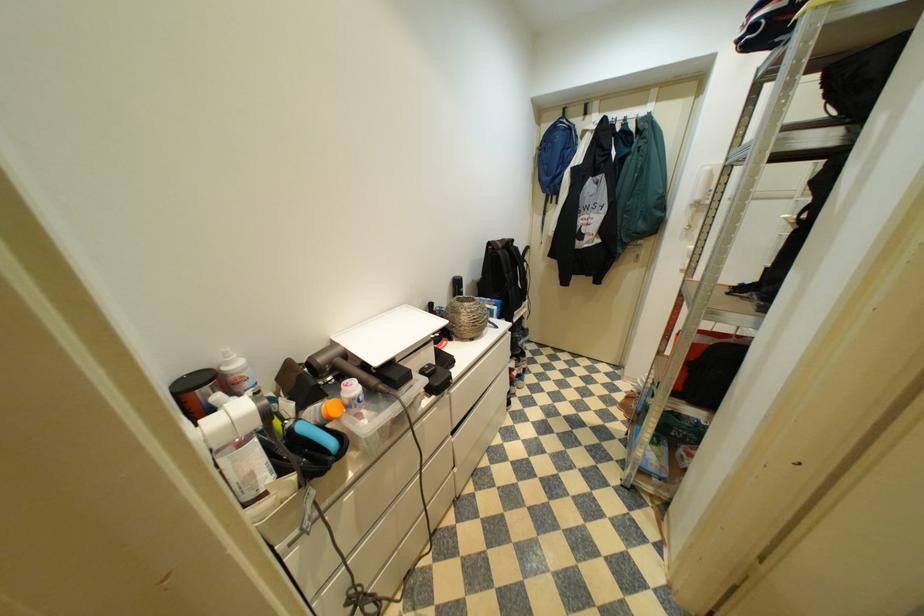
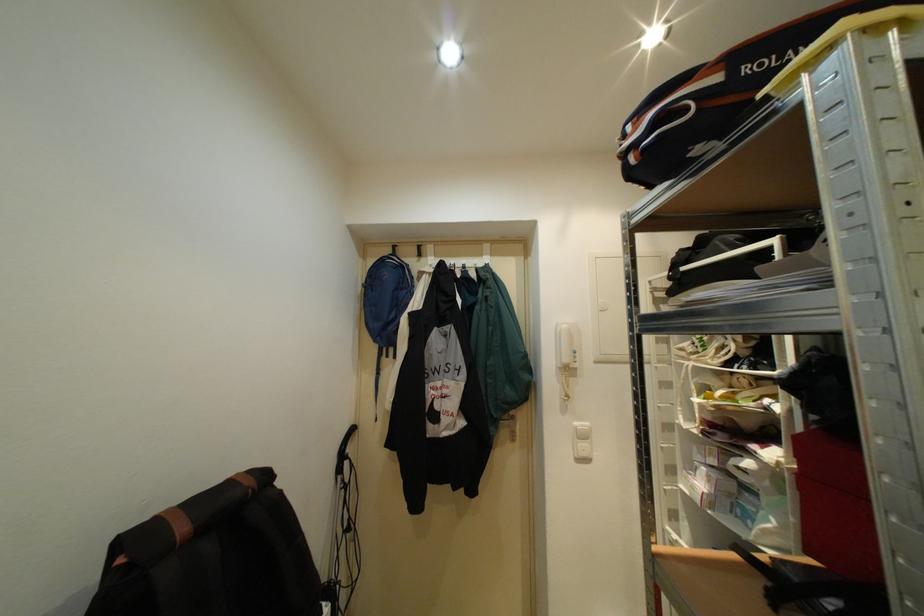
Where in the second image is the point corresponding to the point at 633,246 from the first image?

(505, 424)